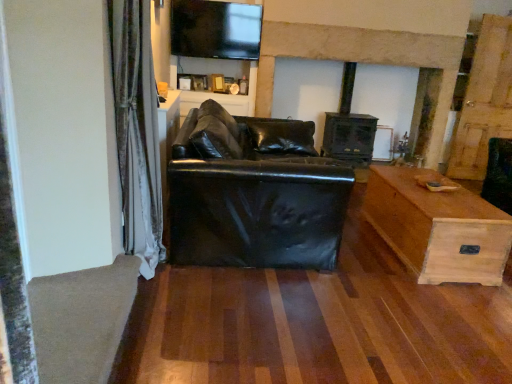
Question: From the image's perspective, is matte black entertainment center at upper center located above or below wooden chest at right?

Choices:
 (A) above
 (B) below

Answer: (A)

Question: Which is correct: matte black entertainment center at upper center is inside wooden chest at right, or outside of it?

Choices:
 (A) outside
 (B) inside

Answer: (A)

Question: Which object is the closest to the wooden chest at right?

Choices:
 (A) matte black entertainment center at upper center
 (B) velvet curtain at left
 (C) black leather couch at center
 (D) dark wood fireplace at center

Answer: (C)

Question: Based on their relative distances, which object is nearer to the black leather couch at center?

Choices:
 (A) wooden chest at right
 (B) velvet curtain at left
 (C) dark wood fireplace at center
 (D) matte black entertainment center at upper center

Answer: (B)